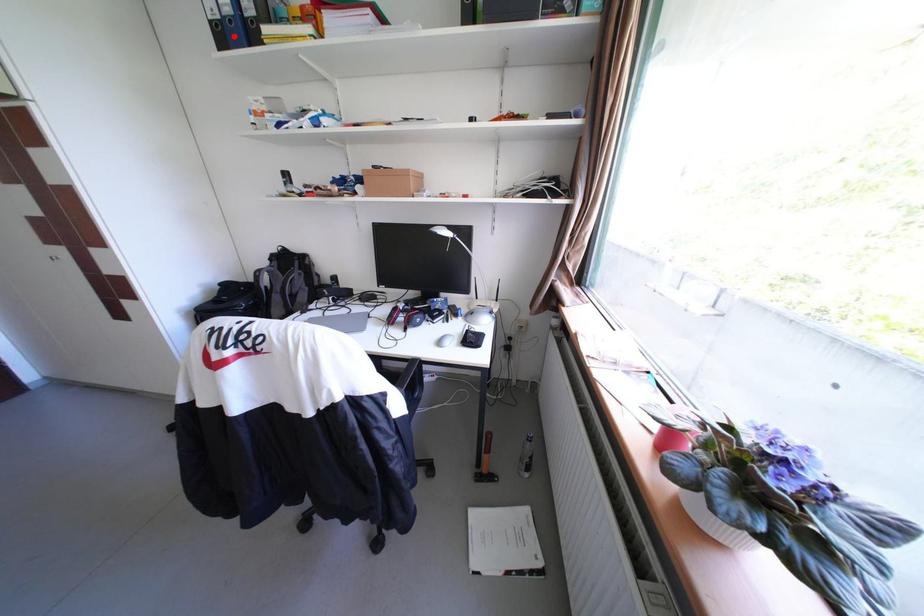
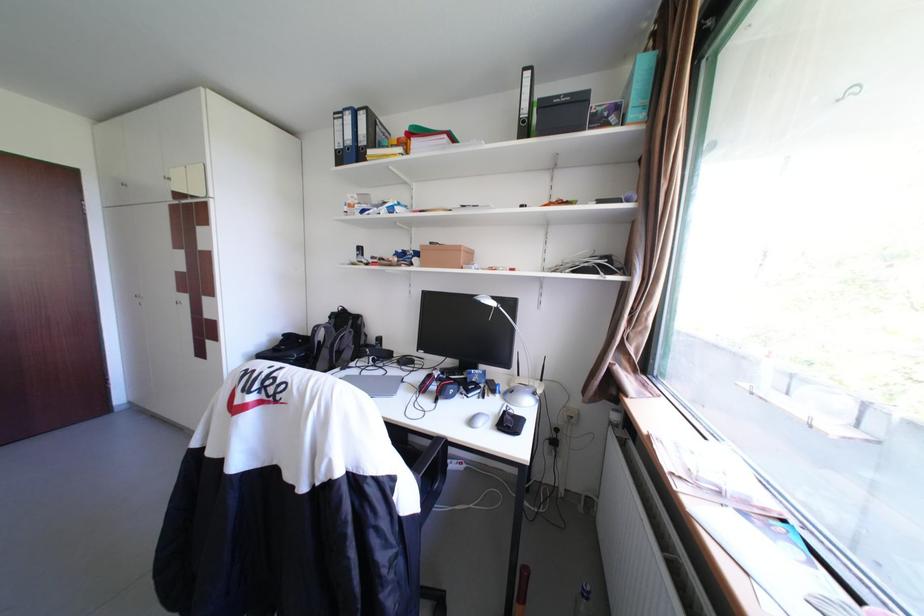
Question: I am providing you with two images of the same scene from different viewpoints. Given a red point in image1, look at the same physical point in image2. Is it:

Choices:
 (A) Closer to the viewpoint
 (B) Farther from the viewpoint

Answer: (A)